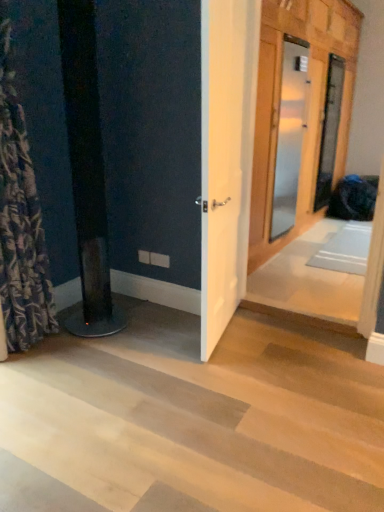
Where is `vacant space to the right of patterned fabric shower curtain at left`? vacant space to the right of patterned fabric shower curtain at left is located at coordinates (79, 358).